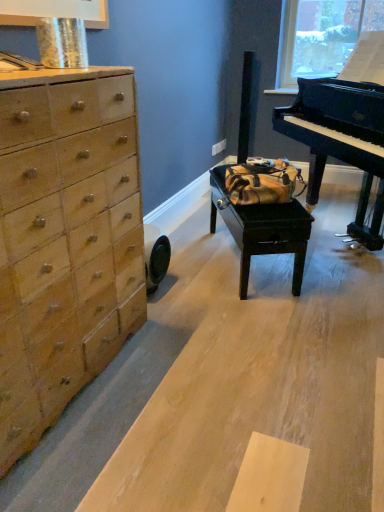
Question: Can you confirm if light brown wood chest of drawers at left is thinner than natural wood plywood at lower left?

Choices:
 (A) no
 (B) yes

Answer: (B)

Question: Could natural wood plywood at lower left be considered to be inside light brown wood chest of drawers at left?

Choices:
 (A) yes
 (B) no

Answer: (B)

Question: From a real-world perspective, is light brown wood chest of drawers at left physically above natural wood plywood at lower left?

Choices:
 (A) yes
 (B) no

Answer: (A)

Question: Considering the relative sizes of light brown wood chest of drawers at left and natural wood plywood at lower left in the image provided, is light brown wood chest of drawers at left shorter than natural wood plywood at lower left?

Choices:
 (A) no
 (B) yes

Answer: (A)

Question: Does light brown wood chest of drawers at left have a greater height compared to natural wood plywood at lower left?

Choices:
 (A) no
 (B) yes

Answer: (B)

Question: Is light brown wood chest of drawers at left further to the viewer compared to natural wood plywood at lower left?

Choices:
 (A) yes
 (B) no

Answer: (B)

Question: Does natural wood plywood at lower left have a lesser width compared to wooden table at center?

Choices:
 (A) no
 (B) yes

Answer: (A)

Question: Is natural wood plywood at lower left further to camera compared to wooden table at center?

Choices:
 (A) no
 (B) yes

Answer: (A)

Question: Can you confirm if natural wood plywood at lower left is smaller than wooden table at center?

Choices:
 (A) no
 (B) yes

Answer: (A)

Question: Can you confirm if natural wood plywood at lower left is shorter than wooden table at center?

Choices:
 (A) yes
 (B) no

Answer: (A)

Question: Can you confirm if natural wood plywood at lower left is positioned to the right of wooden table at center?

Choices:
 (A) yes
 (B) no

Answer: (A)

Question: Considering the relative sizes of natural wood plywood at lower left and wooden table at center in the image provided, is natural wood plywood at lower left wider than wooden table at center?

Choices:
 (A) no
 (B) yes

Answer: (B)

Question: Does wooden table at center appear on the right side of light brown wood chest of drawers at left?

Choices:
 (A) no
 (B) yes

Answer: (B)